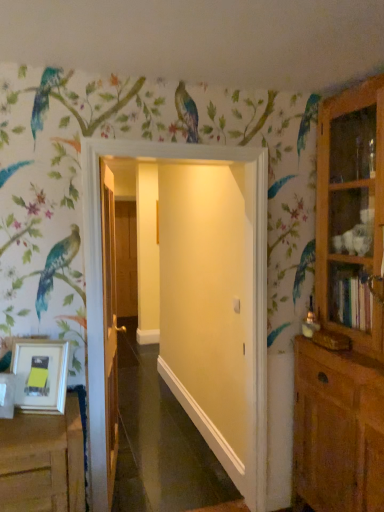
Question: Is point (114, 247) positioned closer to the camera than point (324, 236)?

Choices:
 (A) farther
 (B) closer

Answer: (A)

Question: Is wooden door at center, acting as the second door starting from the back, taller or shorter than wooden cabinet at right?

Choices:
 (A) tall
 (B) short

Answer: (B)

Question: Considering the real-world distances, which object is farthest from the white matte door at center, the first door positioned from the right?

Choices:
 (A) brown wooden door at center, acting as the 3th door starting from the front
 (B) wooden cabinet at right
 (C) wooden door at center, acting as the second door starting from the back
 (D) white matte picture frame at lower left

Answer: (A)

Question: Based on their relative distances, which object is farther from the wooden door at center, which is counted as the second door, starting from the left?

Choices:
 (A) white matte door at center, the first door positioned from the right
 (B) brown wooden door at center, which appears as the 1th door when viewed from the left
 (C) white matte picture frame at lower left
 (D) wooden cabinet at right

Answer: (D)